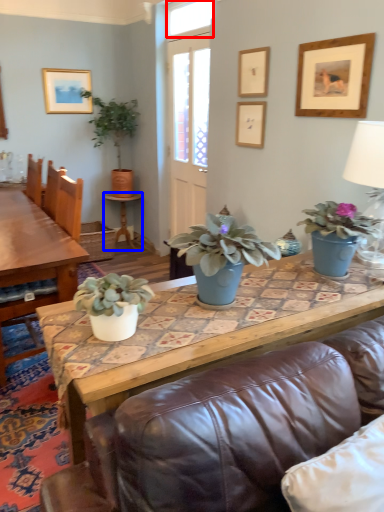
Question: Which object is further to the camera taking this photo, window (highlighted by a red box) or side table (highlighted by a blue box)?

Choices:
 (A) window
 (B) side table

Answer: (B)